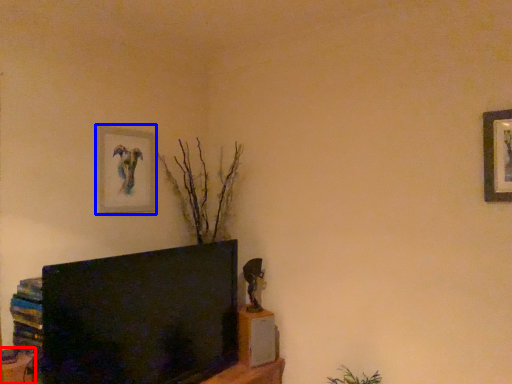
Question: Which object is further to the camera taking this photo, furniture (highlighted by a red box) or picture frame (highlighted by a blue box)?

Choices:
 (A) furniture
 (B) picture frame

Answer: (B)